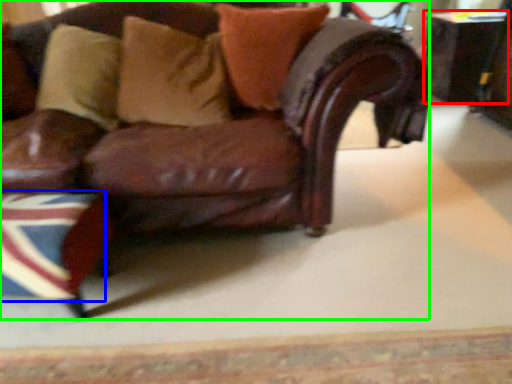
Question: Which object is the closest to the table (highlighted by a red box)? Choose among these: flag (highlighted by a blue box) or chair (highlighted by a green box).

Choices:
 (A) flag
 (B) chair

Answer: (B)